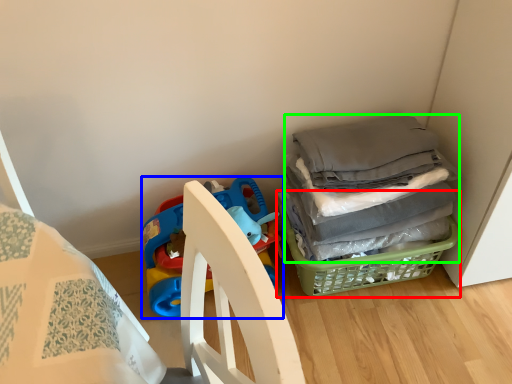
Question: Based on their relative distances, which object is farther from basket (highlighted by a red box)? Choose from toy (highlighted by a blue box) and clothing (highlighted by a green box).

Choices:
 (A) toy
 (B) clothing

Answer: (A)